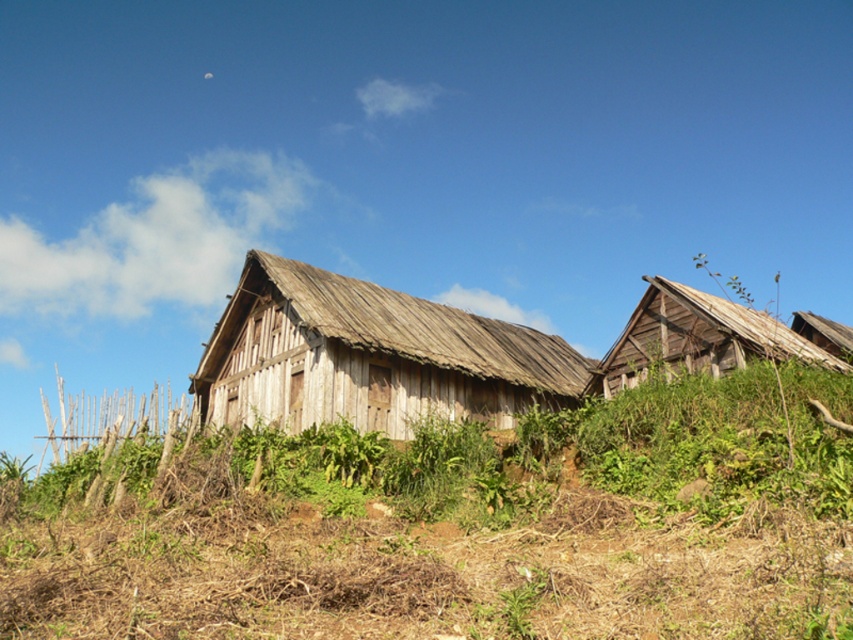
You are a traveler standing at the top of the slope looking down. You see the weathered wood hut at center and the weathered wood hut at right. Which one is closer to your left side?

The weathered wood hut at center is to the left of weathered wood hut at right, so the weathered wood hut at center is closer to your left side.

You are standing at the bottom of the slope and want to walk towards the weathered wood hut at right and the weathered wood hut at upper right. Which one will you see first as you climb the slope?

You will see the weathered wood hut at right first because it is in front of the weathered wood hut at upper right, so it will block the view of the one behind until you move past it.

You are a hiker who wants to take a photo of both weathered wood hut at right and weathered wood hut at upper right. Which one should you stand closer to in order to capture both in a single frame?

You should stand closer to the weathered wood hut at upper right because the weathered wood hut at right is positioned over it, so moving closer to the one behind will help include both in the frame.